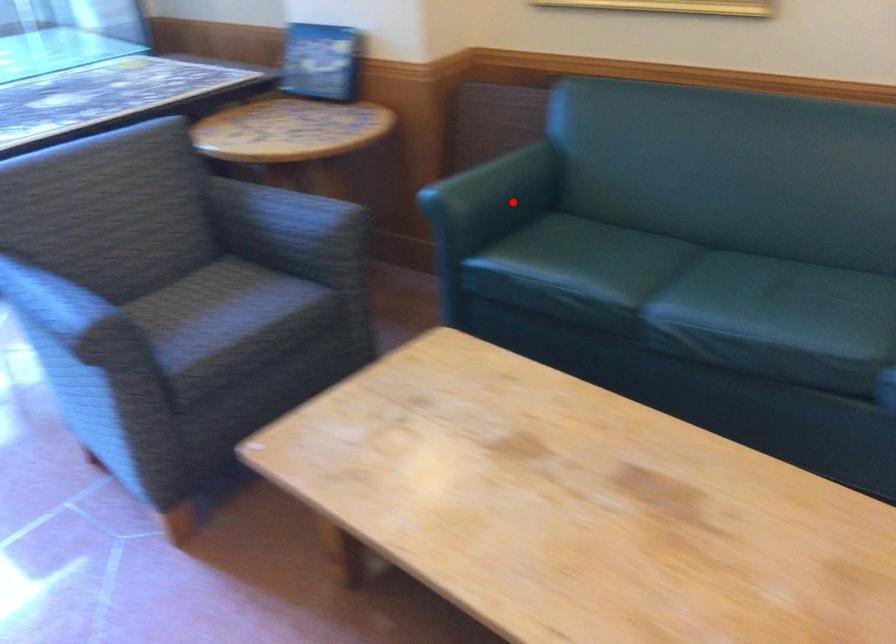
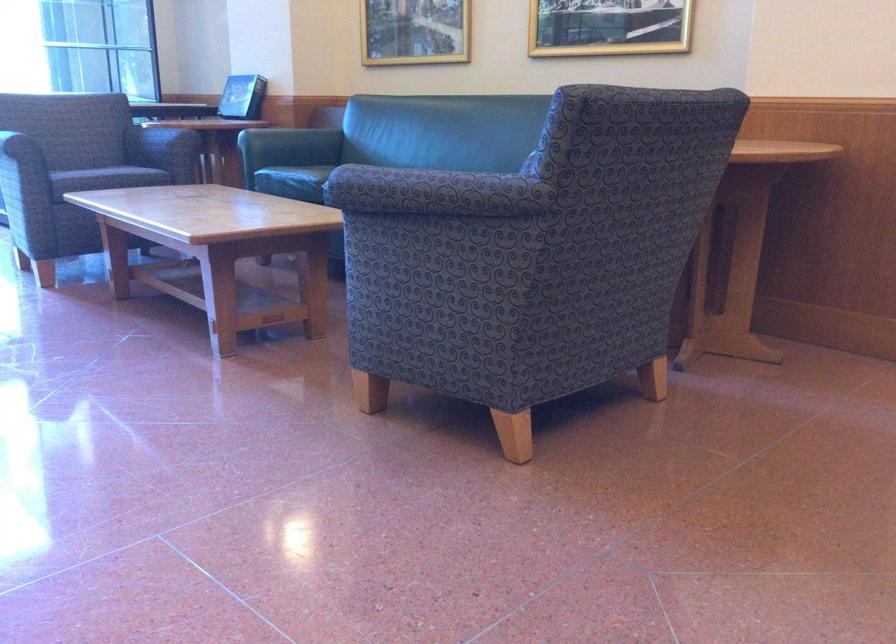
Question: A red point is marked in image1. In image2, is the corresponding 3D point closer to the camera or farther? Reply with the corresponding letter.

Choices:
 (A) The corresponding 3D point is closer.
 (B) The corresponding 3D point is farther.

Answer: (B)